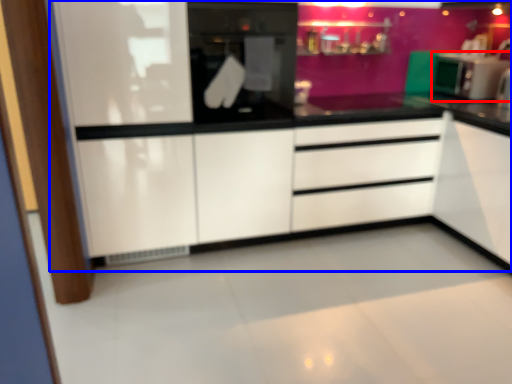
Question: Which point is closer to the camera, kitchen appliance (highlighted by a red box) or dresser (highlighted by a blue box)?

Choices:
 (A) kitchen appliance
 (B) dresser

Answer: (B)